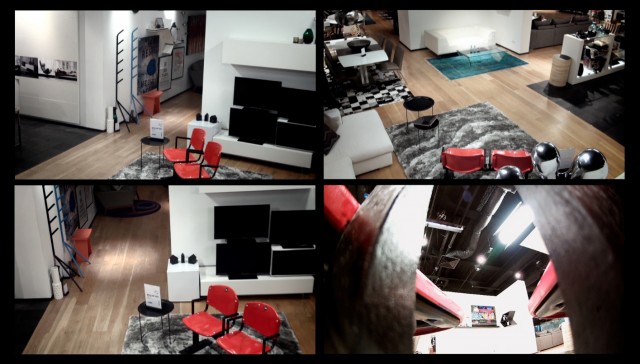
You are a GUI agent. You are given a task and a screenshot of the screen. Output one action in this format:
    pyautogui.click(x=<x>, y=<y>)
    Task: Click on the commercial led lighting
    
    Given the screenshot: What is the action you would take?
    point(509,225)